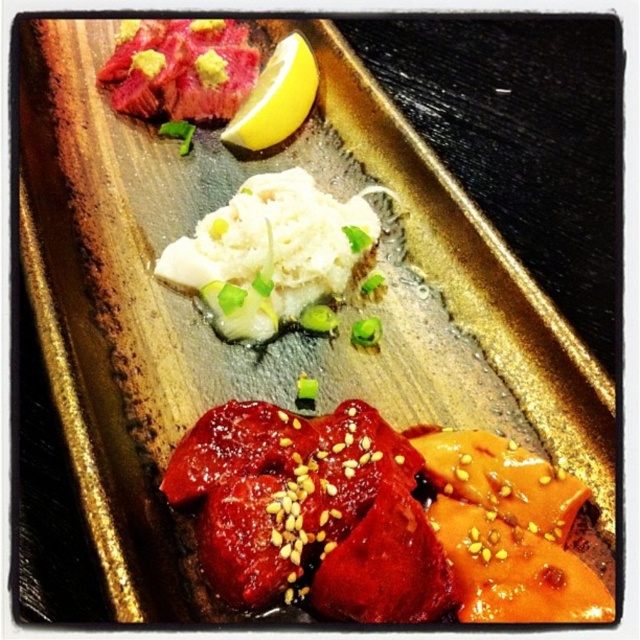
Consider the image. Between white fluffy rice at center and yellow matte lemon at upper center, which one is positioned higher?

yellow matte lemon at upper center

Is point (211, 257) closer to camera compared to point (280, 113)?

That is True.

Is point (237, 276) farther from camera compared to point (275, 76)?

That is False.

Identify the location of white fluffy rice at center. (269, 253).